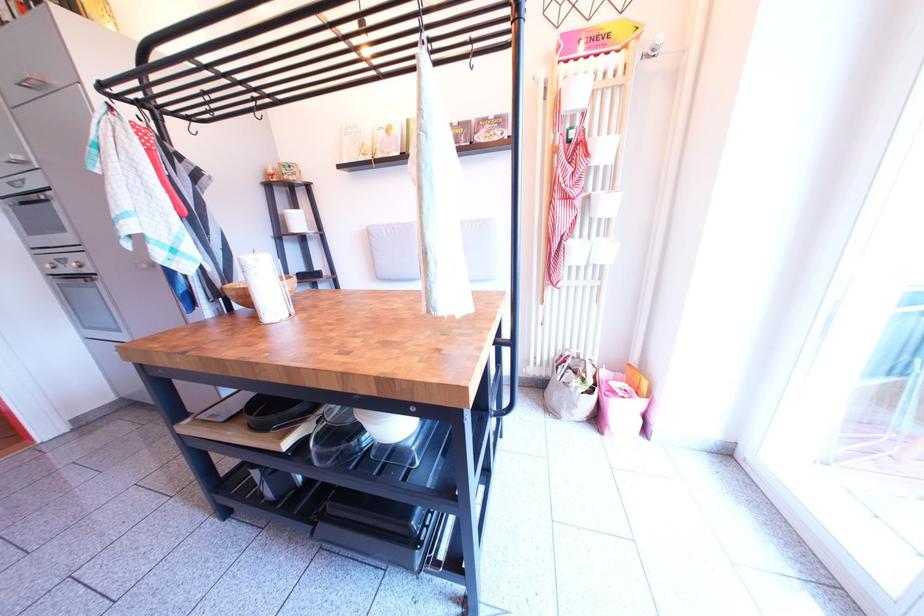
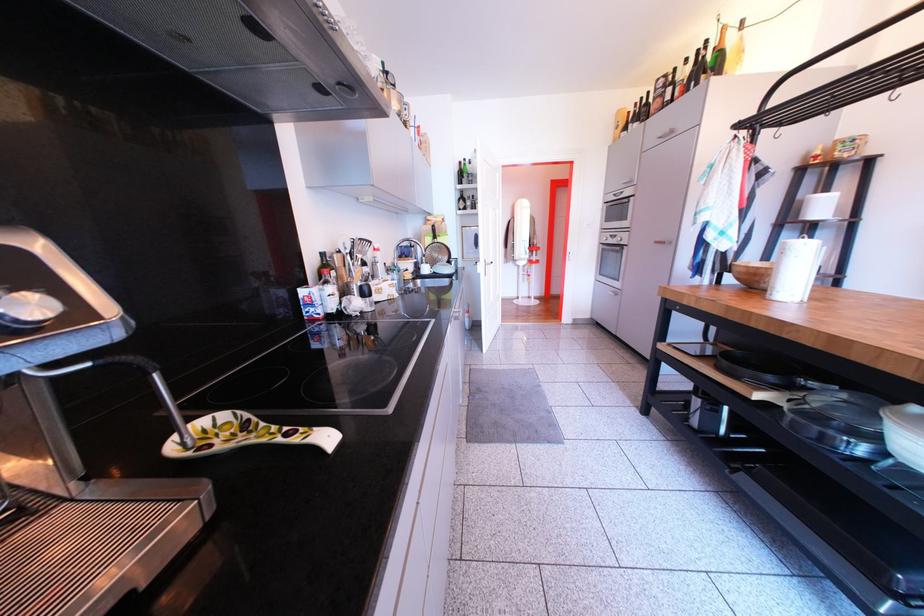
The first image is from the beginning of the video and the second image is from the end. How did the camera likely rotate when shooting the video?

The camera rotated toward left-down.